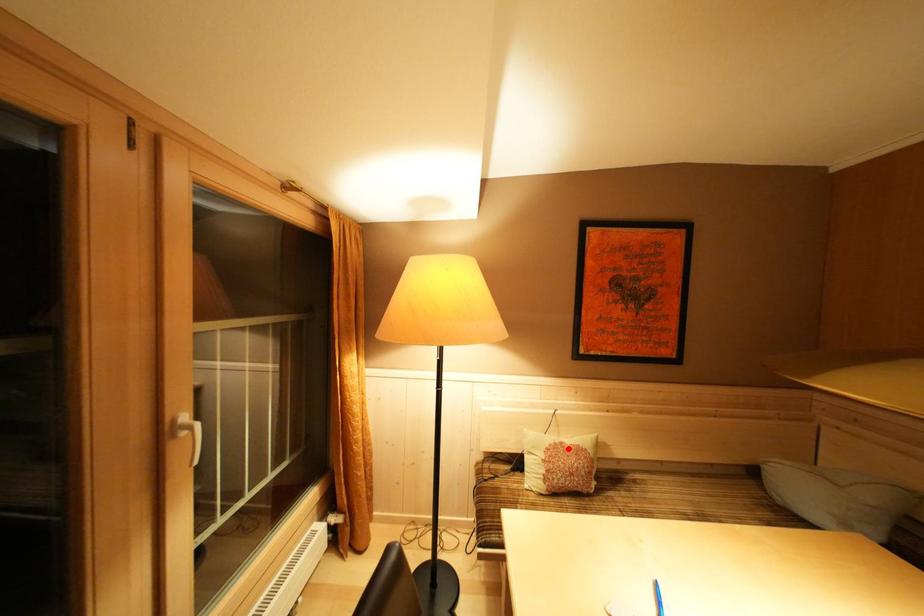
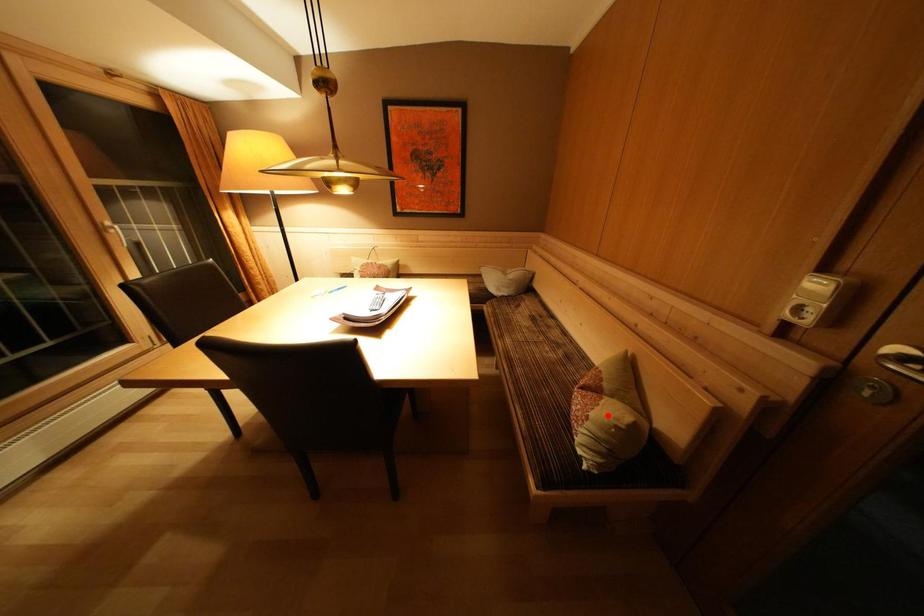
I am providing you with two images of the same scene from different viewpoints. A red point is marked on the first image and another point is marked on the second image. Do the highlighted points in image1 and image2 indicate the same real-world spot?

No